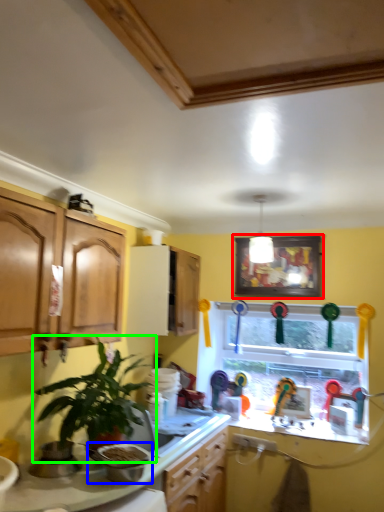
Question: Considering the real-world distances, which object is farthest from picture frame (highlighted by a red box)? appliance (highlighted by a blue box) or houseplant (highlighted by a green box)?

Choices:
 (A) appliance
 (B) houseplant

Answer: (A)